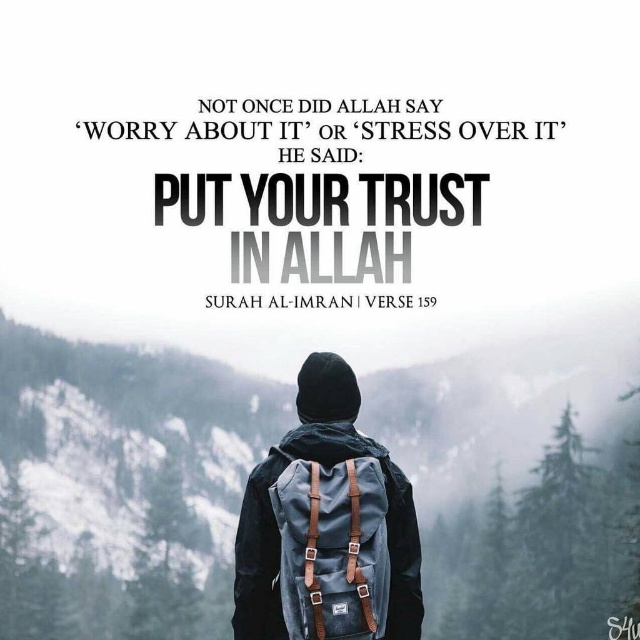
Question: Among these points, which one is nearest to the camera?

Choices:
 (A) (252, 541)
 (B) (317, 593)
 (C) (417, 211)

Answer: (B)

Question: Does gray matte backpack at center appear under dark gray fabric backpack at center?

Choices:
 (A) yes
 (B) no

Answer: (A)

Question: Which of the following is the farthest from the observer?

Choices:
 (A) (340, 589)
 (B) (436, 202)
 (C) (253, 604)

Answer: (B)

Question: From the image, what is the correct spatial relationship of gray matte backpack at center in relation to black matte text at center?

Choices:
 (A) left
 (B) right

Answer: (A)

Question: Which point appears closest to the camera in this image?

Choices:
 (A) (371, 532)
 (B) (241, 598)
 (C) (211, 592)

Answer: (A)

Question: Is gray matte backpack at center wider than black matte text at center?

Choices:
 (A) no
 (B) yes

Answer: (B)